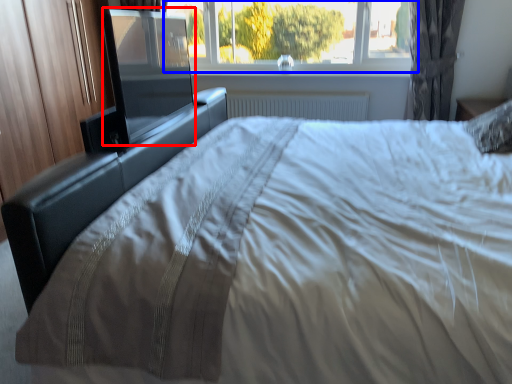
Question: Which point is further to the camera, screen door (highlighted by a red box) or window (highlighted by a blue box)?

Choices:
 (A) screen door
 (B) window

Answer: (B)